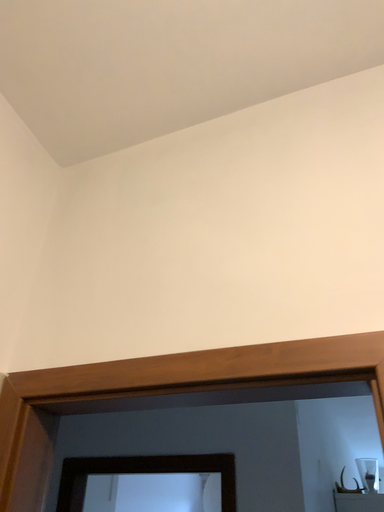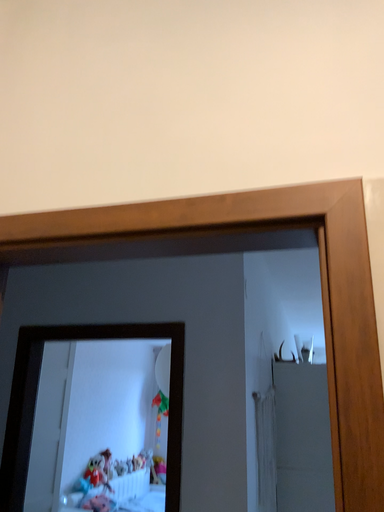
Question: How did the camera likely rotate when shooting the video?

Choices:
 (A) rotated downward
 (B) rotated upward

Answer: (A)